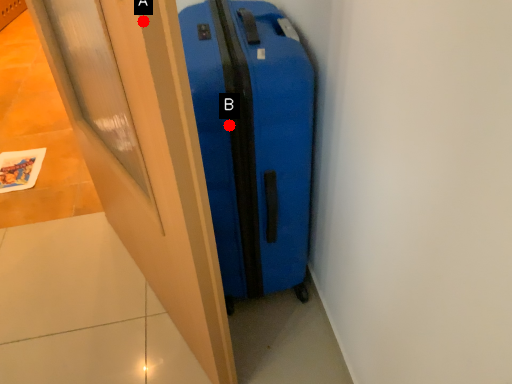
Question: Two points are circled on the image, labeled by A and B beside each circle. Which point is further to the camera?

Choices:
 (A) A is further
 (B) B is further

Answer: (B)